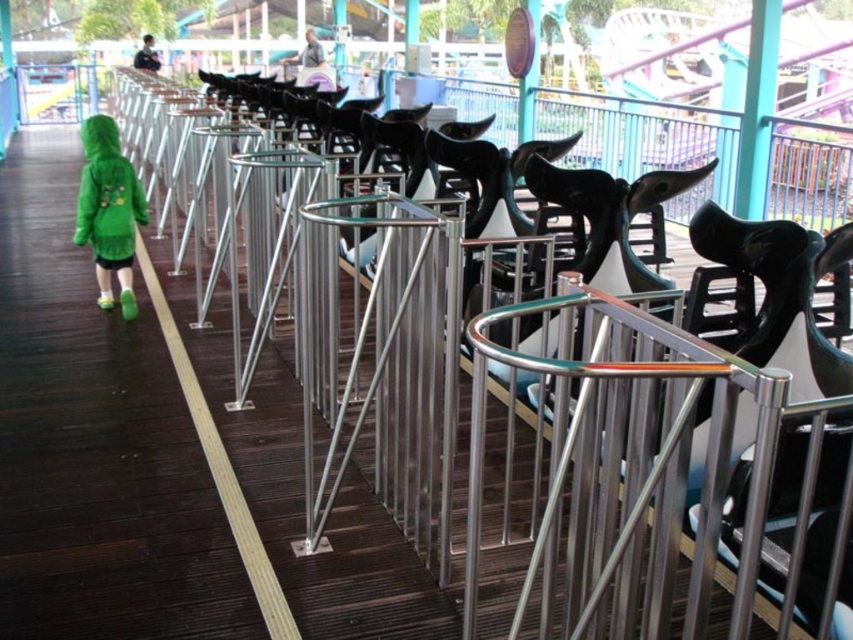
You are a park visitor trying to reach the carousel. You see the green matte jacket at left and the brushed metal sign at upper center. Which object is wider from your perspective?

The green matte jacket at left is wider than the brushed metal sign at upper center.

You are standing at the entrance of the amusement park ride and see the point marked at coordinates (x=108, y=211). What object is located at that point?

The point at coordinates (x=108, y=211) corresponds to the green matte jacket at left.